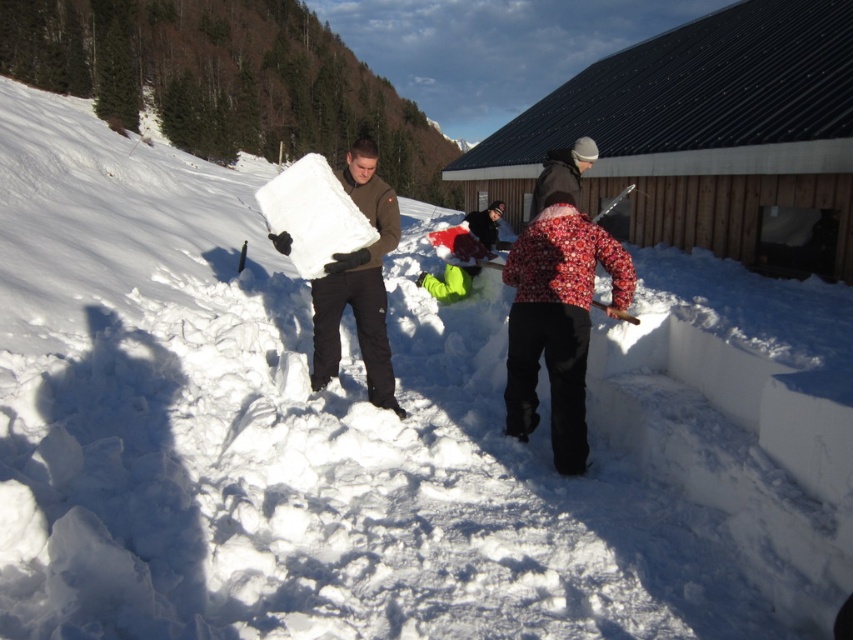
Question: Which point is farther from the camera taking this photo?

Choices:
 (A) (338, 356)
 (B) (840, 172)
 (C) (578, 193)
 (D) (575, 288)

Answer: (C)

Question: Can you confirm if floral-patterned jacket at center is thinner than dark brown woolen hat at upper center?

Choices:
 (A) yes
 (B) no

Answer: (B)

Question: Can you confirm if white matte ice at center is thinner than dark brown woolen hat at upper center?

Choices:
 (A) no
 (B) yes

Answer: (A)

Question: Which point appears farthest from the camera in this image?

Choices:
 (A) (527, 404)
 (B) (701, 99)
 (C) (393, 196)

Answer: (B)

Question: Is floral-patterned jacket at center thinner than dark brown woolen hat at upper center?

Choices:
 (A) yes
 (B) no

Answer: (B)

Question: Which object appears farthest from the camera in this image?

Choices:
 (A) dark brown woolen hat at upper center
 (B) floral-patterned jacket at center
 (C) white matte ice at center
 (D) dark brown wooden hut at upper right

Answer: (A)